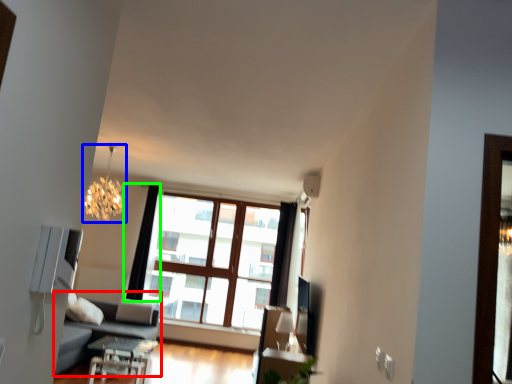
Question: Which is nearer to the studio couch (highlighted by a red box)? lamp (highlighted by a blue box) or curtain (highlighted by a green box).

Choices:
 (A) lamp
 (B) curtain

Answer: (B)